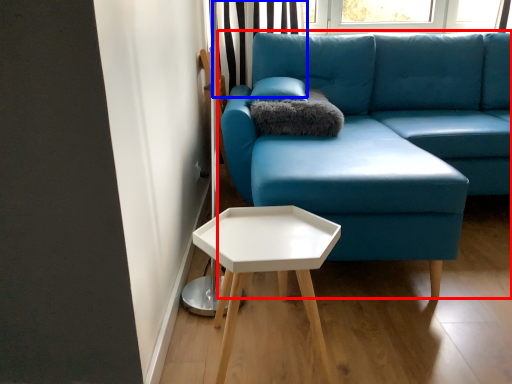
Question: Among these objects, which one is nearest to the camera, studio couch (highlighted by a red box) or curtain (highlighted by a blue box)?

Choices:
 (A) studio couch
 (B) curtain

Answer: (A)